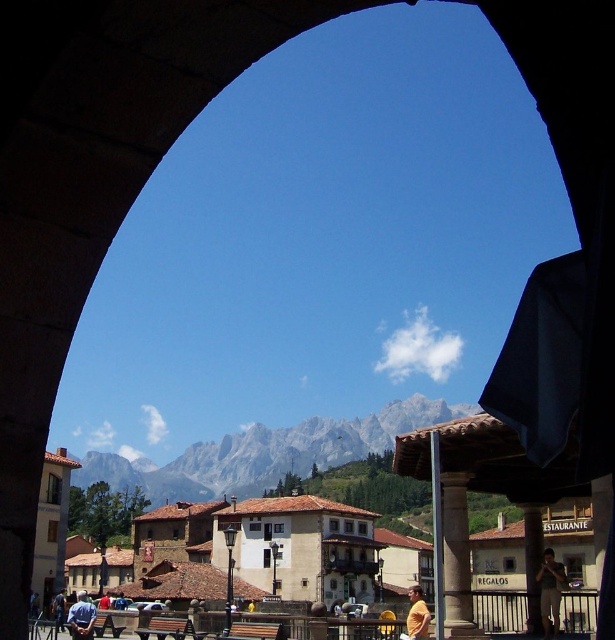
Question: Can you confirm if dark brown leather jacket at lower right is positioned below blue fabric shirt at lower left?

Choices:
 (A) no
 (B) yes

Answer: (A)

Question: Does dark brown leather jacket at lower right have a lesser width compared to blue fabric shirt at lower left?

Choices:
 (A) no
 (B) yes

Answer: (B)

Question: Which point is farther to the camera?

Choices:
 (A) blue shirt at lower left
 (B) dark brown leather jacket at lower right
 (C) rugged stone mountain at center
 (D) blue fabric shirt at lower left

Answer: (C)

Question: Observing the image, what is the correct spatial positioning of yellow matte shirt at lower center in reference to blue shirt at lower left?

Choices:
 (A) left
 (B) right

Answer: (B)

Question: Which object is the farthest from the blue fabric shirt at lower left?

Choices:
 (A) dark brown leather jacket at lower right
 (B) yellow matte shirt at lower center

Answer: (B)

Question: Among these points, which one is farthest from the camera?

Choices:
 (A) (199, 444)
 (B) (419, 620)

Answer: (A)